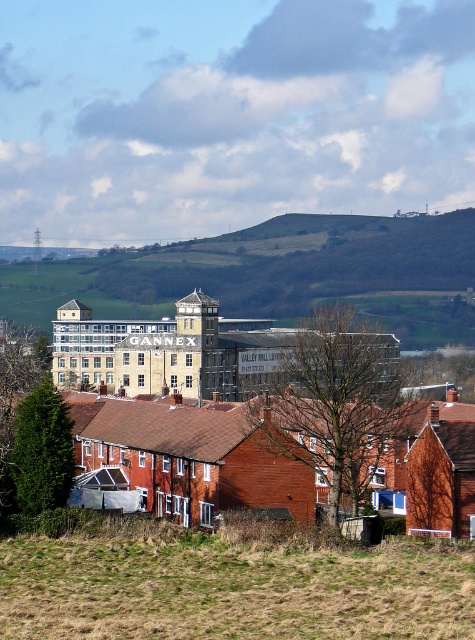
Is yellow brick building at center taller than green leafy tree at lower left?

→ Yes, yellow brick building at center is taller than green leafy tree at lower left.

Is point (316, 340) behind point (50, 508)?

Yes, point (316, 340) is behind point (50, 508).

Does point (390, 433) lie behind point (7, 484)?

Yes, it is behind point (7, 484).

You are a GUI agent. You are given a task and a screenshot of the screen. Output one action in this format:
    pyautogui.click(x=<x>, y=<y>)
    Task: Click on the yellow brick building at center
    
    Given the screenshot: What is the action you would take?
    pyautogui.click(x=260, y=435)

Can you confirm if bare branches at center is positioned to the left of green leafy tree at lower left?

In fact, bare branches at center is to the right of green leafy tree at lower left.

Is point (322, 349) positioned before point (46, 486)?

That is True.

This screenshot has width=475, height=640. What are the coordinates of `bare branches at center` in the screenshot? It's located at (342, 404).

Is yellow brick building at center shorter than bare branches at center?

Incorrect, yellow brick building at center's height does not fall short of bare branches at center's.

Who is shorter, yellow brick building at center or bare branches at center?

bare branches at center

Between point (463, 522) and point (391, 376), which one is positioned behind?

Point (463, 522)

This screenshot has width=475, height=640. Identify the location of yellow brick building at center. (260, 435).